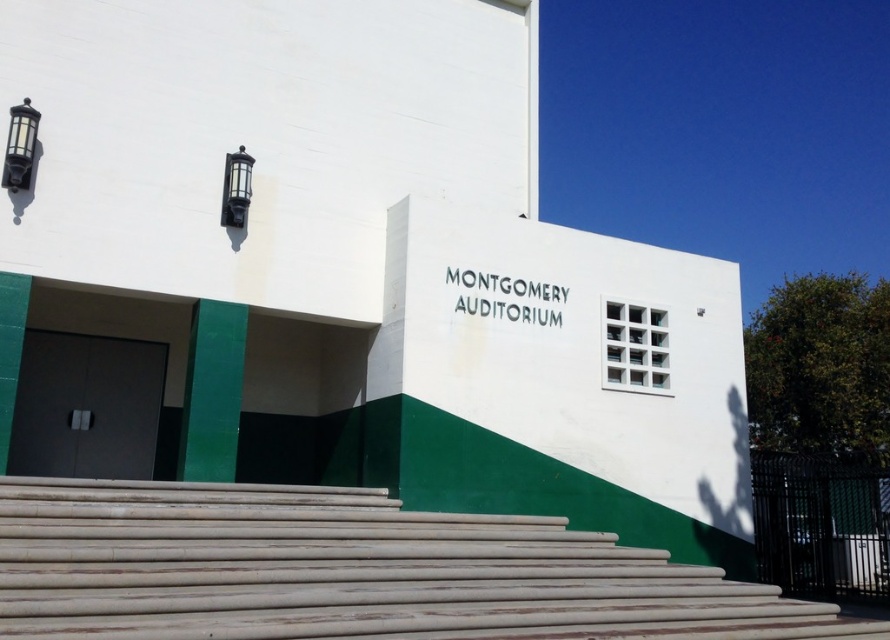
Question: Is wooden at center to the left of matte black door at left from the viewer's perspective?

Choices:
 (A) no
 (B) yes

Answer: (A)

Question: Is wooden at center thinner than matte black door at left?

Choices:
 (A) no
 (B) yes

Answer: (A)

Question: Is wooden at center positioned in front of matte black door at left?

Choices:
 (A) yes
 (B) no

Answer: (A)

Question: Among these objects, which one is farthest from the camera?

Choices:
 (A) matte black door at left
 (B) wooden at center

Answer: (A)